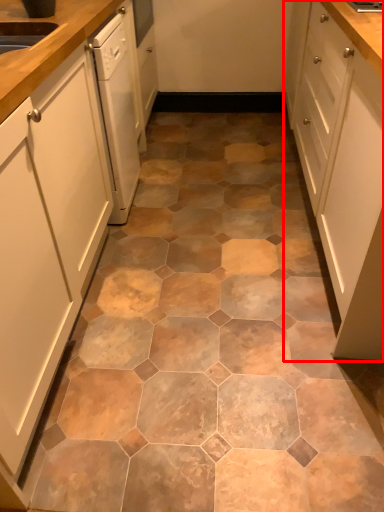
Question: From the image's perspective, where is cabinetry (annotated by the red box) located relative to cabinetry?

Choices:
 (A) above
 (B) below

Answer: (A)